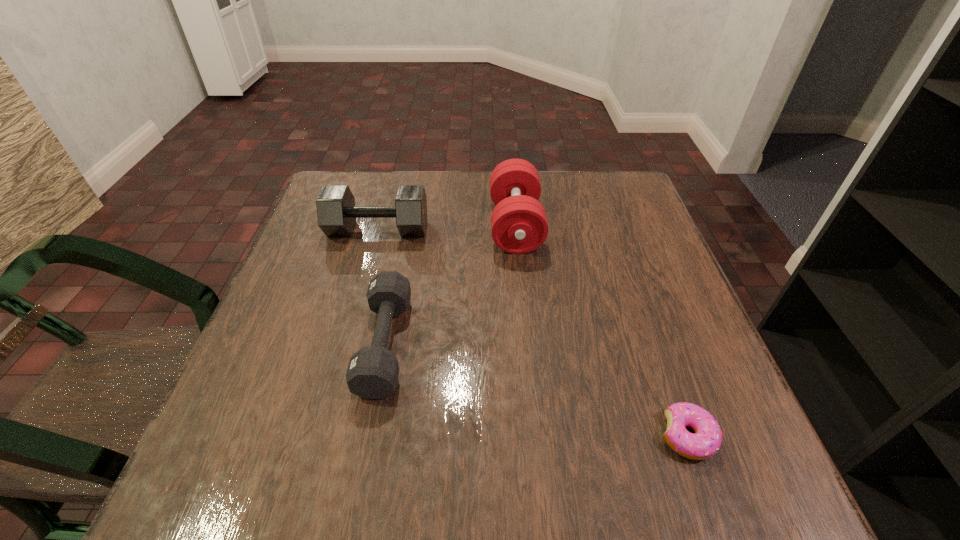
Identify the location of the second object from right to left. The width and height of the screenshot is (960, 540). (519, 225).

I want to click on the second tallest dumbbell, so click(336, 211).

The image size is (960, 540). Find the location of `the shortest dumbbell`. the shortest dumbbell is located at coordinates (372, 373).

Image resolution: width=960 pixels, height=540 pixels. Identify the location of the third tallest object. [372, 373].

Where is `doughnut`? This screenshot has height=540, width=960. doughnut is located at coordinates (706, 441).

Image resolution: width=960 pixels, height=540 pixels. I want to click on the shortest object, so click(706, 441).

Image resolution: width=960 pixels, height=540 pixels. I want to click on vacant space located 0.050m on the back of the rightmost dumbbell, so click(x=512, y=188).

You are a GUI agent. You are given a task and a screenshot of the screen. Output one action in this format:
    pyautogui.click(x=<x>, y=<y>)
    Task: Click on the vacant space located 0.250m on the front of the second tallest object
    
    Given the screenshot: What is the action you would take?
    pyautogui.click(x=351, y=328)

Where is `vacant space positioned on the back of the second shortest object`? The image size is (960, 540). vacant space positioned on the back of the second shortest object is located at coordinates (399, 271).

Locate an element on the screen. The height and width of the screenshot is (540, 960). vacant space located 0.170m on the left of the nearest object is located at coordinates (549, 436).